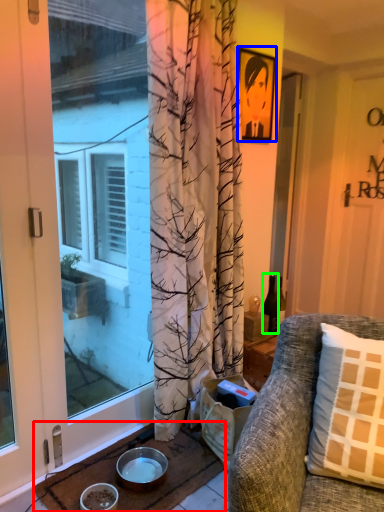
Question: Which object is positioned farthest from doormat (highlighted by a red box)? Select from picture frame (highlighted by a blue box) and bottle (highlighted by a green box).

Choices:
 (A) picture frame
 (B) bottle

Answer: (A)